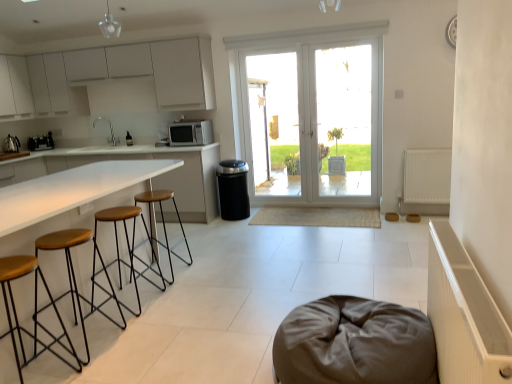
Question: Is white ribbed radiator at right, which appears as the 1th radiator when viewed from the front, facing away from wooden seat with metal legs at center, marked as the 4th stool in a front-to-back arrangement?

Choices:
 (A) no
 (B) yes

Answer: (A)

Question: Considering the relative positions of white ribbed radiator at right, acting as the 2th radiator starting from the right, and wooden seat with metal legs at center, marked as the 4th stool in a front-to-back arrangement, in the image provided, is white ribbed radiator at right, acting as the 2th radiator starting from the right, to the right of wooden seat with metal legs at center, marked as the 4th stool in a front-to-back arrangement, from the viewer's perspective?

Choices:
 (A) no
 (B) yes

Answer: (B)

Question: Is white ribbed radiator at right, the 2th radiator positioned from the top, positioned in front of wooden seat with metal legs at center, marked as the 4th stool in a front-to-back arrangement?

Choices:
 (A) yes
 (B) no

Answer: (A)

Question: Is white ribbed radiator at right, the 2th radiator when ordered from back to front, positioned far away from wooden seat with metal legs at center, marked as the 4th stool in a front-to-back arrangement?

Choices:
 (A) yes
 (B) no

Answer: (A)

Question: Considering the relative sizes of white ribbed radiator at right, acting as the first radiator starting from the left, and wooden seat with metal legs at center, arranged as the 1th stool when viewed from the back, in the image provided, is white ribbed radiator at right, acting as the first radiator starting from the left, smaller than wooden seat with metal legs at center, arranged as the 1th stool when viewed from the back,?

Choices:
 (A) yes
 (B) no

Answer: (B)

Question: Can you confirm if white ribbed radiator at right, which appears as the 1th radiator when viewed from the front, is shorter than wooden seat with metal legs at center, arranged as the 1th stool when viewed from the back?

Choices:
 (A) no
 (B) yes

Answer: (A)

Question: Considering the relative sizes of brown wood/black metal stool at left, marked as the 2th stool in a front-to-back arrangement, and brushed metal kettle at left, acting as the second appliance starting from the right, in the image provided, is brown wood/black metal stool at left, marked as the 2th stool in a front-to-back arrangement, taller than brushed metal kettle at left, acting as the second appliance starting from the right,?

Choices:
 (A) no
 (B) yes

Answer: (B)

Question: From a real-world perspective, does brown wood/black metal stool at left, acting as the 3th stool starting from the back, stand above brushed metal kettle at left, the 1th appliance when ordered from left to right?

Choices:
 (A) yes
 (B) no

Answer: (B)

Question: Is brown wood/black metal stool at left, acting as the 3th stool starting from the back, closer to the viewer compared to brushed metal kettle at left, the 1th appliance when ordered from left to right?

Choices:
 (A) no
 (B) yes

Answer: (B)

Question: Would you say brown wood/black metal stool at left, marked as the 2th stool in a front-to-back arrangement, is a long distance from brushed metal kettle at left, acting as the second appliance starting from the right?

Choices:
 (A) no
 (B) yes

Answer: (B)

Question: Is brown wood/black metal stool at left, marked as the 2th stool in a front-to-back arrangement, positioned beyond the bounds of brushed metal kettle at left, the 1th appliance when ordered from left to right?

Choices:
 (A) yes
 (B) no

Answer: (A)

Question: Is brown wood/black metal stool at left, acting as the 3th stool starting from the back, oriented towards brushed metal kettle at left, the 1th appliance when ordered from left to right?

Choices:
 (A) yes
 (B) no

Answer: (B)

Question: Would you say white glass door at center is part of white matte radiator at right, the second radiator when ordered from bottom to top,'s contents?

Choices:
 (A) yes
 (B) no

Answer: (B)